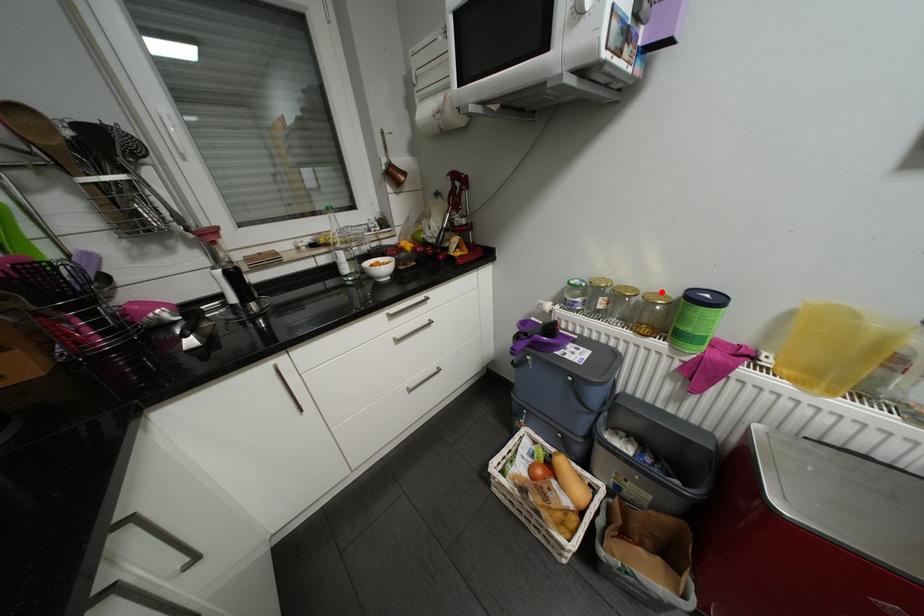
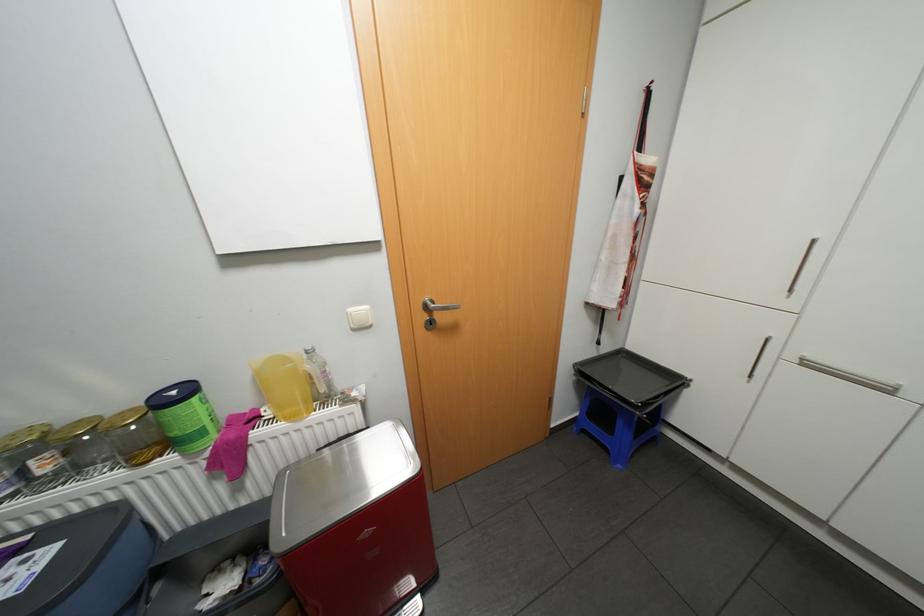
Where in the second image is the point corresponding to the highlighted location from the first image?

(128, 411)